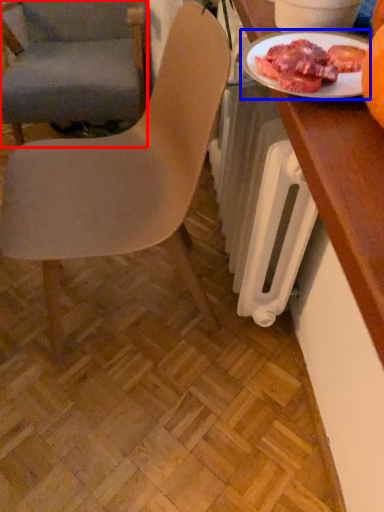
Question: Which of the following is the farthest to the observer, chair (highlighted by a red box) or tableware (highlighted by a blue box)?

Choices:
 (A) chair
 (B) tableware

Answer: (A)